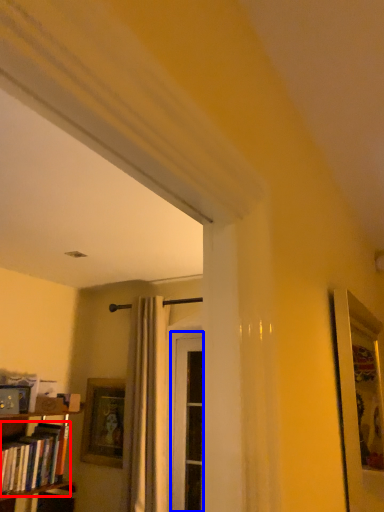
Question: Which point is further to the camera, book (highlighted by a red box) or screen door (highlighted by a blue box)?

Choices:
 (A) book
 (B) screen door

Answer: (B)